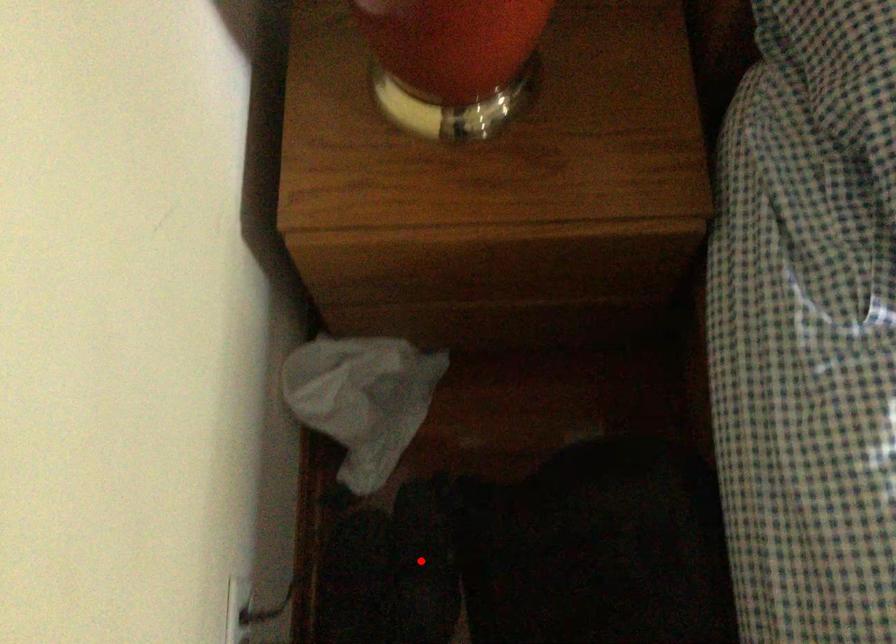
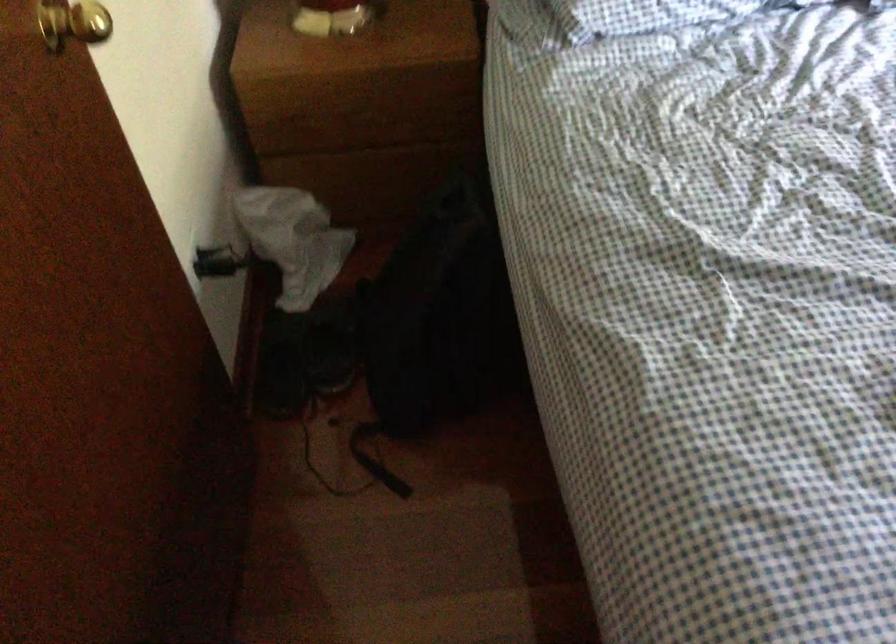
The point at the highlighted location is marked in the first image. Where is the corresponding point in the second image?

(332, 345)